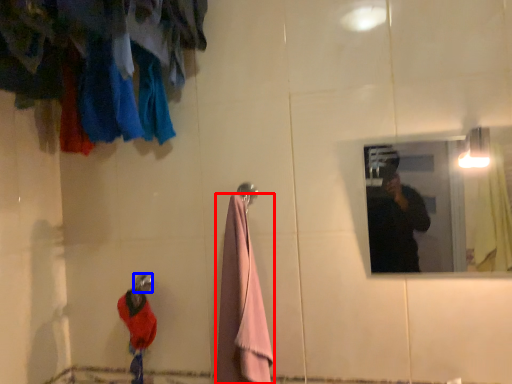
Question: Among these objects, which one is nearest to the camera, towel/napkin (highlighted by a red box) or shower (highlighted by a blue box)?

Choices:
 (A) towel/napkin
 (B) shower

Answer: (A)